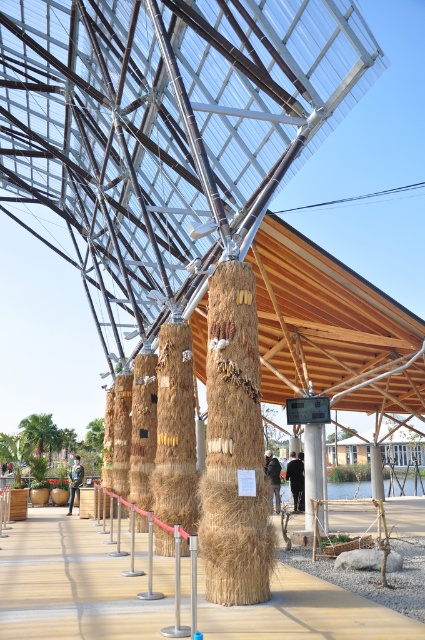
Question: Can you confirm if wooden walkway at center is positioned below braided straw column at center?

Choices:
 (A) no
 (B) yes

Answer: (B)

Question: Can you confirm if wooden walkway at center is positioned above braided straw column at center?

Choices:
 (A) yes
 (B) no

Answer: (B)

Question: Which of the following is the closest to the observer?

Choices:
 (A) wooden walkway at center
 (B) braided straw column at center

Answer: (A)

Question: Is wooden walkway at center further to camera compared to braided straw column at center?

Choices:
 (A) yes
 (B) no

Answer: (B)

Question: Which point is farther from the camera taking this photo?

Choices:
 (A) (220, 330)
 (B) (345, 618)

Answer: (A)